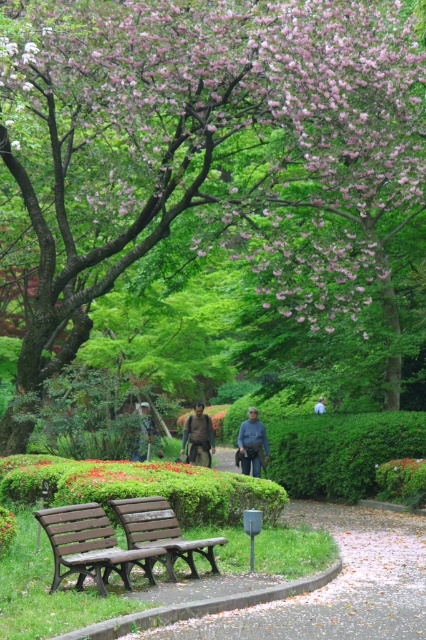
Consider the image. You are a park visitor who wants to borrow a jacket from the lost and found. You see the brown leather jacket at center and the dark blue uniform at center. Which one is bigger in size?

The brown leather jacket at center has a larger size compared to the dark blue uniform at center, so the brown leather jacket at center is bigger.

You are standing at the point with coordinates point (256, 461) and want to walk towards the point with coordinates point (262, 428). According to the park layout, will you be moving forward or backward relative to the direction you are facing?

Since point (262, 428) is behind point (256, 461), moving towards it would mean you are walking backward relative to your current facing direction.